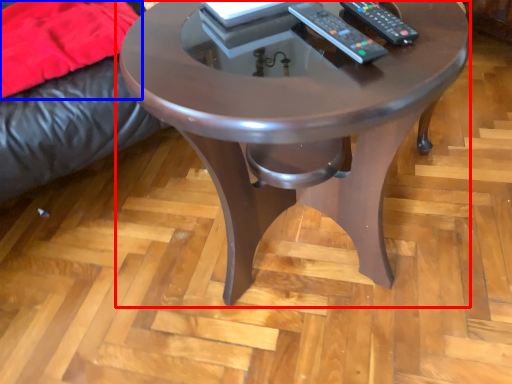
Question: Which of the following is the closest to the observer, coffee table (highlighted by a red box) or blanket (highlighted by a blue box)?

Choices:
 (A) coffee table
 (B) blanket

Answer: (A)